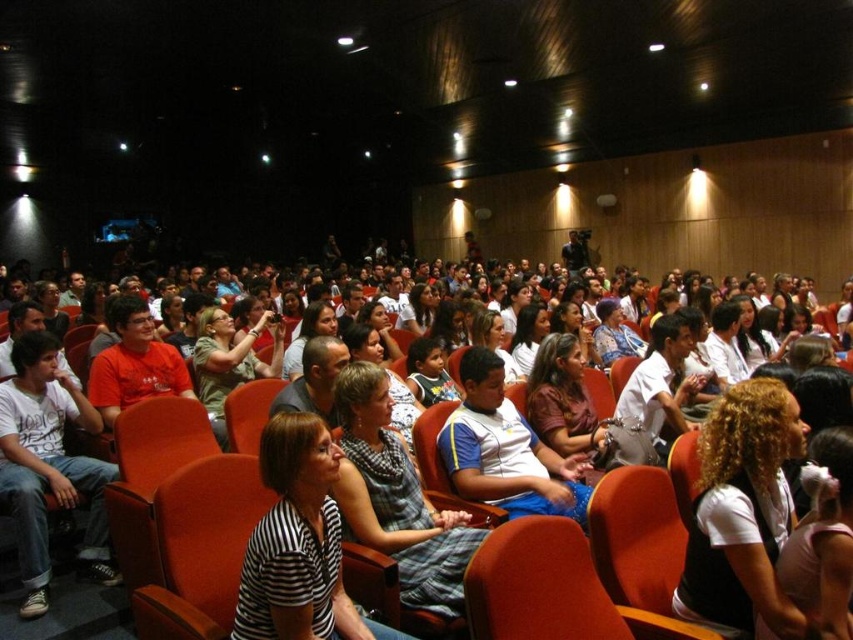
Question: Can you confirm if white cotton shirt at left is thinner than matte orange chair at center?

Choices:
 (A) yes
 (B) no

Answer: (A)

Question: Is striped cotton shirt at center to the left of matte orange chair at center from the viewer's perspective?

Choices:
 (A) no
 (B) yes

Answer: (B)

Question: Among these objects, which one is nearest to the camera?

Choices:
 (A) matte orange chair at center
 (B) white matte shirt at center
 (C) blue and white striped shirt at center

Answer: (A)

Question: Among these points, which one is farthest from the camera?

Choices:
 (A) (583, 560)
 (B) (421, 368)
 (C) (630, 332)

Answer: (C)

Question: Does matte orange chair at center have a smaller size compared to matte blue shirt at center?

Choices:
 (A) no
 (B) yes

Answer: (B)

Question: Among these objects, which one is farthest from the camera?

Choices:
 (A) matte orange chair at center
 (B) blue jersey at center

Answer: (B)